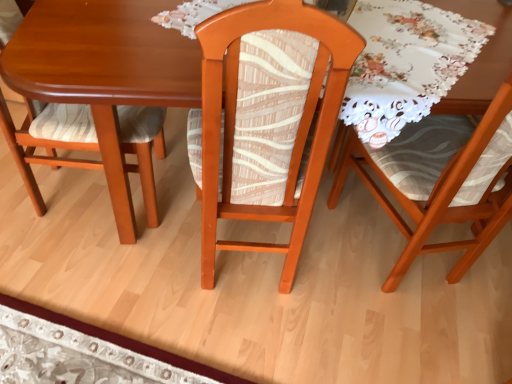
At what (x,y) coordinates should I click in order to perform the action: click on blank space to the left of wooden chair at center, which appears as the second chair when viewed from the right. Please return your answer as a coordinate pair (x, y). The width and height of the screenshot is (512, 384). Looking at the image, I should click on (141, 253).